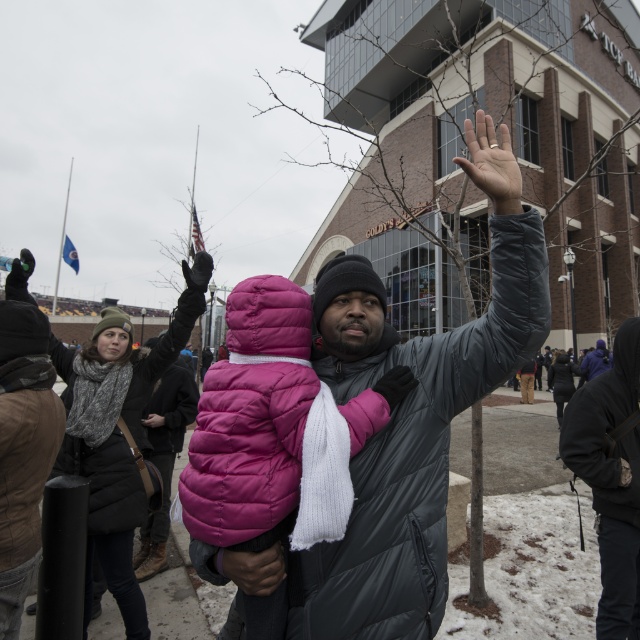
You are a photographer trying to capture a closeup of the gray knit scarf at upper left and the matte black glove at upper center. Which object should you focus on first if you want to ensure both are in focus without adjusting the camera settings?

The gray knit scarf at upper left is located below the matte black glove at upper center, so focusing on the matte black glove at upper center first would allow the gray knit scarf at upper left to be in focus as well since it is closer to the camera.

You are standing at point (211, 262) and want to walk to point (147, 625). Is the destination point behind you or in front of you?

The destination point (147, 625) is behind you because it is located behind point (211, 262) where you are standing.